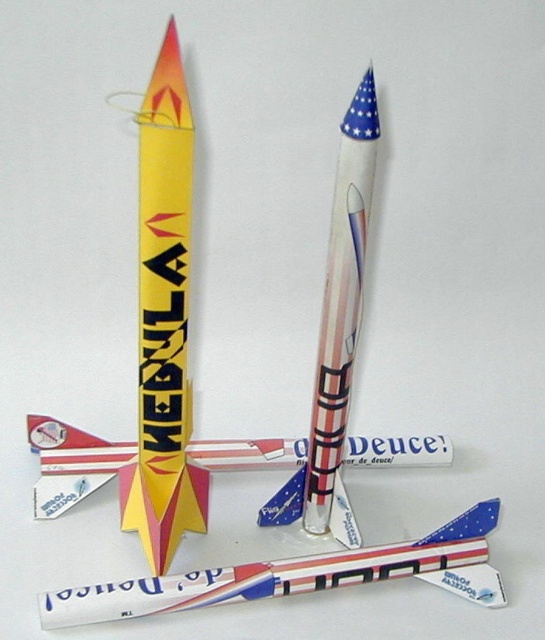
You are an astronaut who just landed on a distant planet and see the yellow matte rocket at center and the white glossy rocket at lower center. Which rocket is positioned to the left?

The yellow matte rocket at center is positioned to the left of the white glossy rocket at lower center.

You are an airport security officer inspecting two items at the center of your workstation. You have an american flag paper rocket at center and a metallic silver airplane at center. Which item is positioned higher?

The american flag paper rocket at center is above the metallic silver airplane at center, so the american flag paper rocket at center is positioned higher.